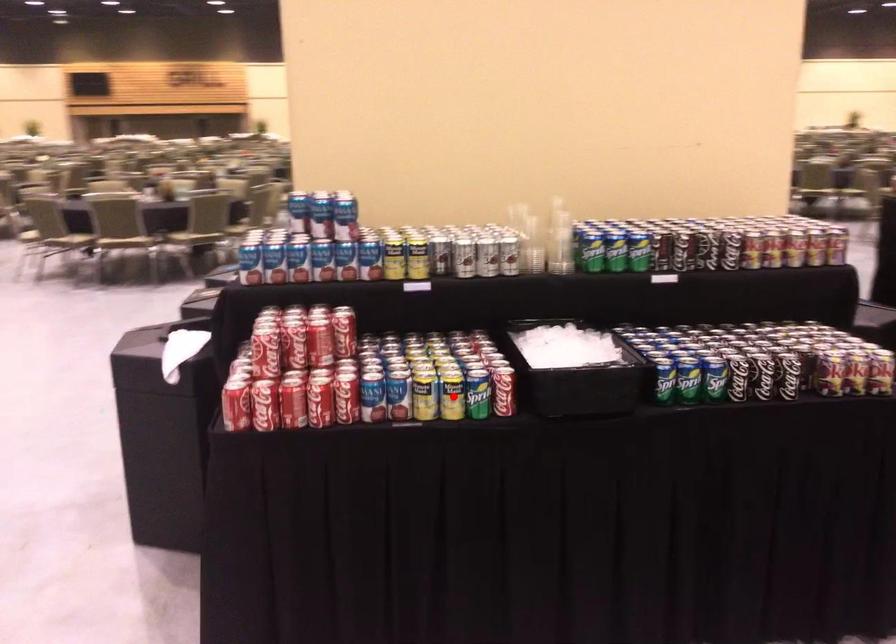
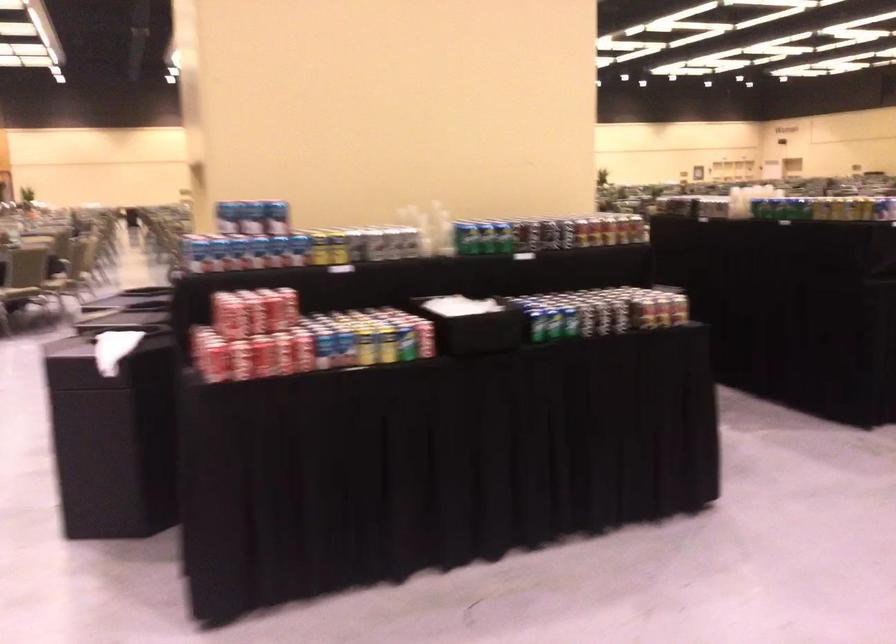
Question: I am providing you with two images of the same scene from different viewpoints. Image1 has a red point marked. In image2, the corresponding 3D location appears at what relative position? Reply with the corresponding letter.

Choices:
 (A) Closer
 (B) Farther

Answer: (B)